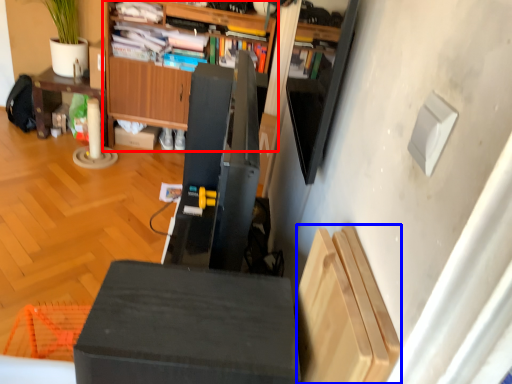
Question: Which object appears farthest to the camera in this image, cabinetry (highlighted by a red box) or shelf (highlighted by a blue box)?

Choices:
 (A) cabinetry
 (B) shelf

Answer: (A)